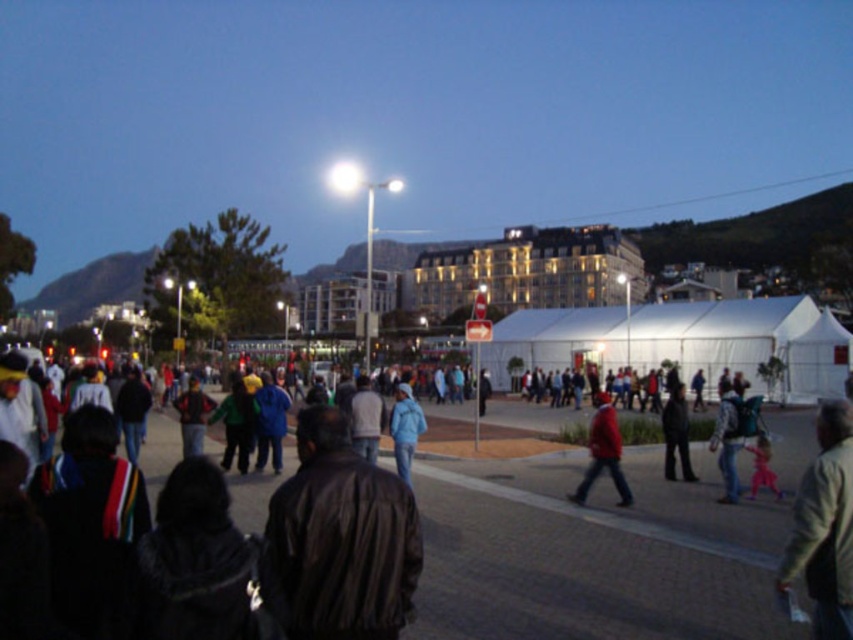
You are a photographer trying to capture both the matte red jacket at center and the blue matte jacket at center in a single frame. Which jacket should you adjust your camera angle to focus on first if you want to include both in the shot?

The matte red jacket at center is positioned on the right side of the blue matte jacket at center, so you should focus on the blue matte jacket at center first to ensure both are included in the frame.

You are standing at the origin point of the coordinate system in the image. You want to walk towards the white fabric tent at center. Which direction should you move?

Since the white fabric tent at center is located at coordinate point 0.534 on the x axis and 0.801 on the y axis, you should move towards the northeast direction to reach it.